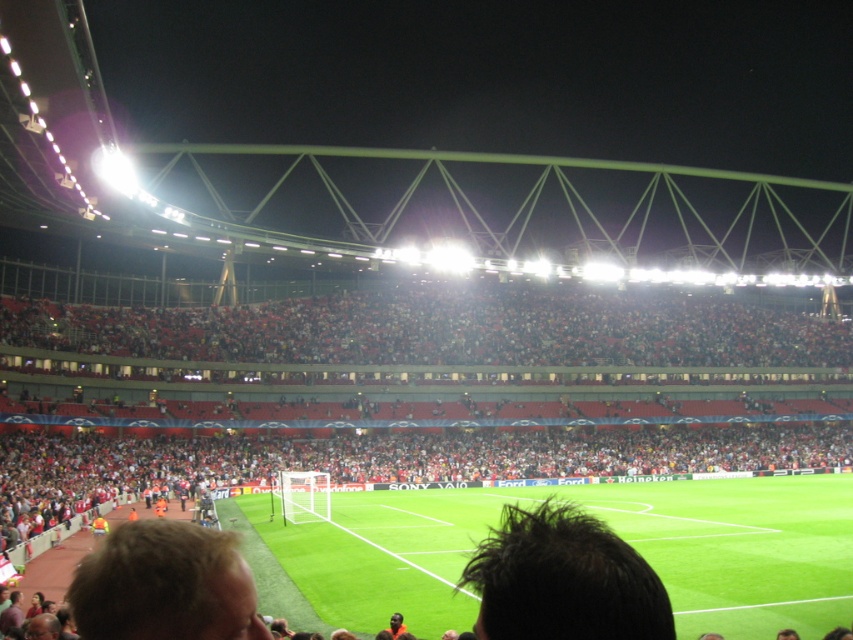
Is point (846, 518) positioned behind point (625, 636)?

Yes.

Measure the distance between green grass football field at center and camera.

82.48 feet

Locate an element on the screen. green grass football field at center is located at coordinates (608, 525).

Does point (378, 525) come behind point (207, 620)?

Yes, it is behind point (207, 620).

Between point (850, 600) and point (229, 636), which one is positioned behind?

Point (850, 600)

Find the location of a particular element. This screenshot has height=640, width=853. green grass football field at center is located at coordinates (608, 525).

Is dark brown hair at center positioned at the back of blonde hair at lower left?

No, dark brown hair at center is closer to the viewer.

Which is behind, point (540, 625) or point (180, 586)?

The point (180, 586) is behind.

This screenshot has width=853, height=640. Describe the element at coordinates (563, 580) in the screenshot. I see `dark brown hair at center` at that location.

The image size is (853, 640). I want to click on dark brown hair at center, so click(563, 580).